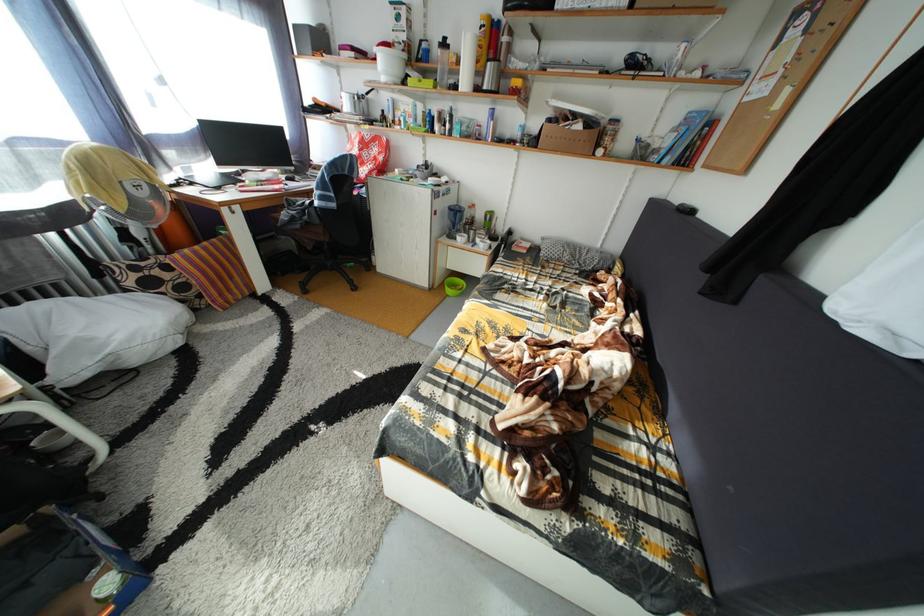
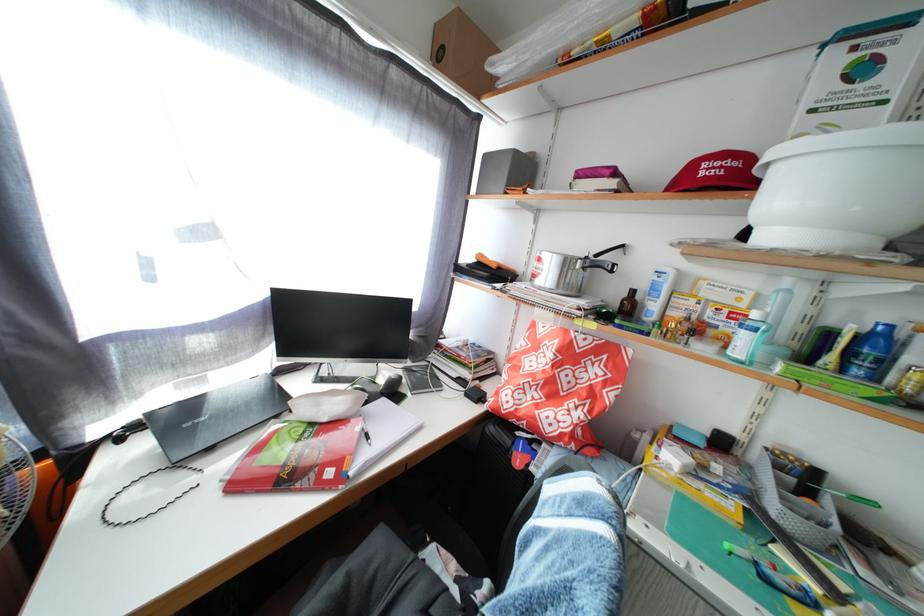
The point at (386, 121) is marked in the first image. Where is the corresponding point in the second image?

(621, 301)